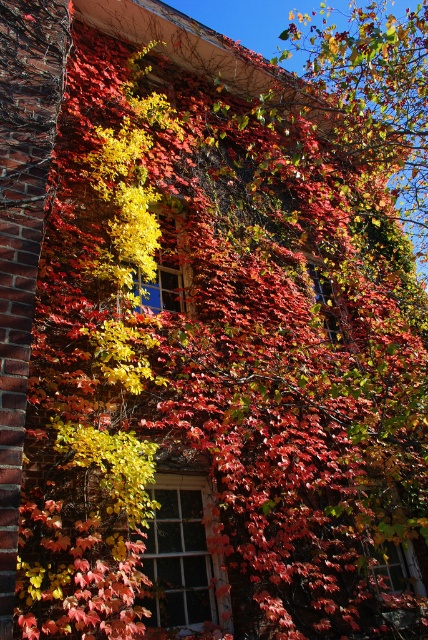
You are an architect assessing the building facade. You notice both the white wooden window at center and the transparent glass window at center. Which window has a larger area?

The transparent glass window at center has a larger area since the white wooden window at center is smaller than it according to the description.

You are an architect evaluating the building facade. You need to determine if the white wooden window at center can fit vertically into the space currently occupied by the transparent glass window at center. Can it fit?

The white wooden window at center is shorter than the transparent glass window at center, so it can fit vertically into the space.

You are a painter standing on a ladder in front of the brick building. You need to paint the white wooden window at center and the transparent glass window at center. If your ladder can only reach 4 meters, can you paint both windows without moving the ladder?

The white wooden window at center and transparent glass window at center are 4.12 meters apart from each other. Since the ladder can only reach 4 meters, you will need to move the ladder to paint both windows.